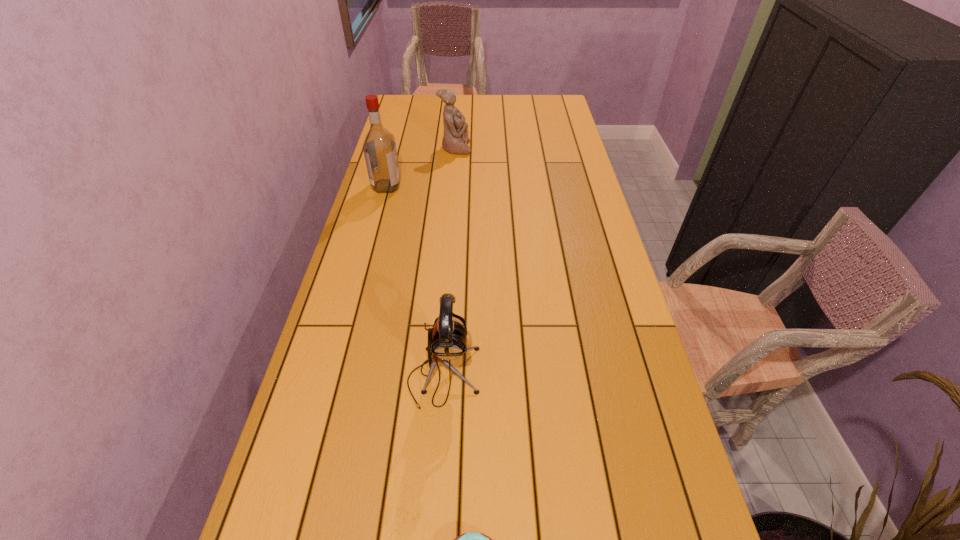
The width and height of the screenshot is (960, 540). I want to click on liquor, so click(x=379, y=146).

Image resolution: width=960 pixels, height=540 pixels. Find the location of `the third nearest object`. the third nearest object is located at coordinates (379, 146).

Image resolution: width=960 pixels, height=540 pixels. I want to click on the farthest object, so click(455, 137).

At what (x,y) coordinates should I click in order to perform the action: click on earphone. Please return your answer as a coordinate pair (x, y). Looking at the image, I should click on (446, 339).

Where is `vacant region located 0.310m on the front-facing side of the second farthest object`? This screenshot has width=960, height=540. vacant region located 0.310m on the front-facing side of the second farthest object is located at coordinates (487, 186).

This screenshot has height=540, width=960. Identify the location of free space located on the front-facing side of the figurine. (534, 148).

Identify the location of free location located on the right of the earphone. (647, 376).

What are the coordinates of `object positioned at the left edge` in the screenshot? It's located at (379, 146).

This screenshot has width=960, height=540. Identify the location of free space at the far edge of the desktop. (475, 97).

You are a GUI agent. You are given a task and a screenshot of the screen. Output one action in this format:
    pyautogui.click(x=<x>, y=<y>)
    Task: Click on the vacant space at the left edge of the desktop
    This screenshot has width=960, height=540.
    Given the screenshot: What is the action you would take?
    pyautogui.click(x=363, y=430)